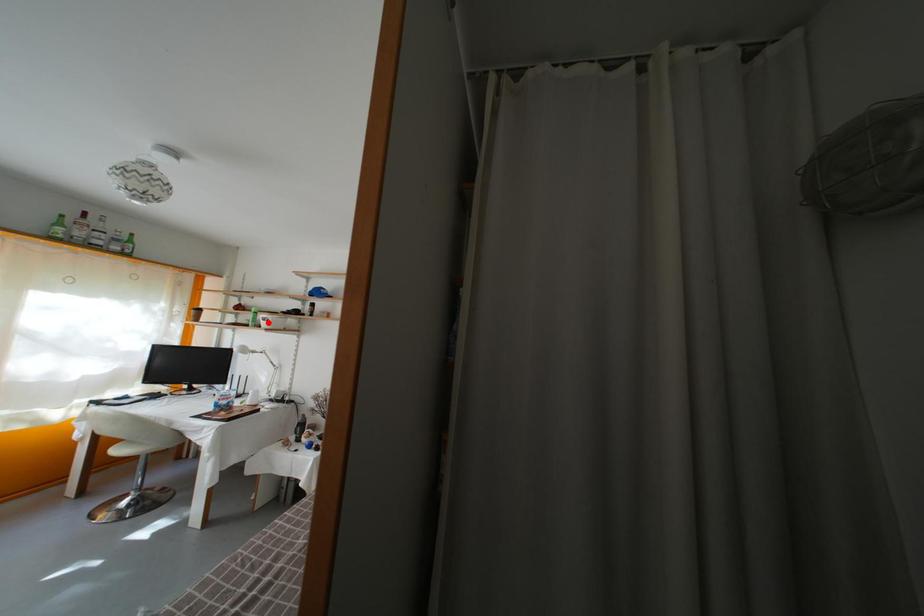
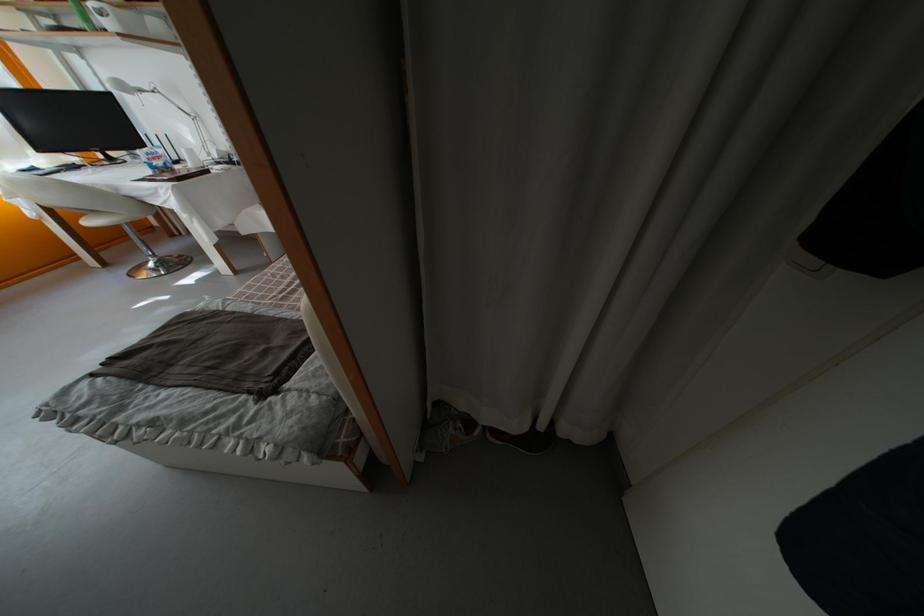
Find the pixel in the second image that matches the highlighted location in the first image.

(96, 12)